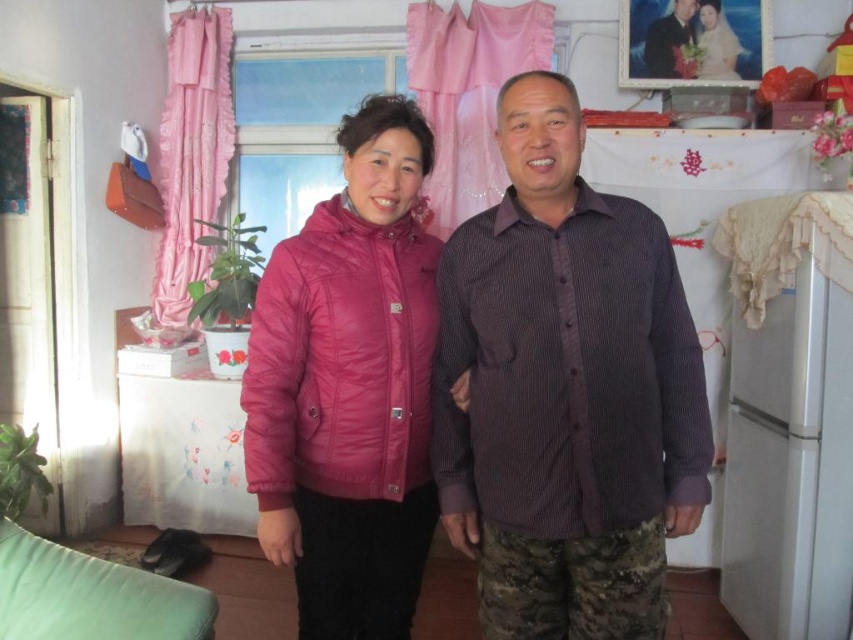
From the picture: You are moving a pink quilted jacket at center and a white matte refrigerator at right into a storage room. The storage room has a height limit of 1.5 meters. Can both items fit vertically without bending or tilting them?

The pink quilted jacket at center is shorter than the white matte refrigerator at right. Since the refrigerator is taller, if the refrigerator is under 1.5 meters, both can fit. However, if the refrigerator exceeds 1.5 meters, only the jacket would fit. Without exact measurements, we can only say the jacket definitely fits, but the refrigerator might not.

You are standing in the room and want to reach a point that is exactly 1.49 meters away from where you are currently standing. Can you reach the point at coordinates point (549, 218)?

The point at coordinates point (549, 218) is exactly 1.49 meters away from the camera, so yes, you can reach it if you move towards that point.

You are a delivery person who needs to place a small package on the white matte refrigerator at right. However, there is a purple corduroy shirt at center blocking the way. Can you place the package on the refrigerator without moving the shirt?

The purple corduroy shirt at center is in front of the white matte refrigerator at right, so it is blocking access to the refrigerator. To place the package on the refrigerator, you would need to move the shirt out of the way first.